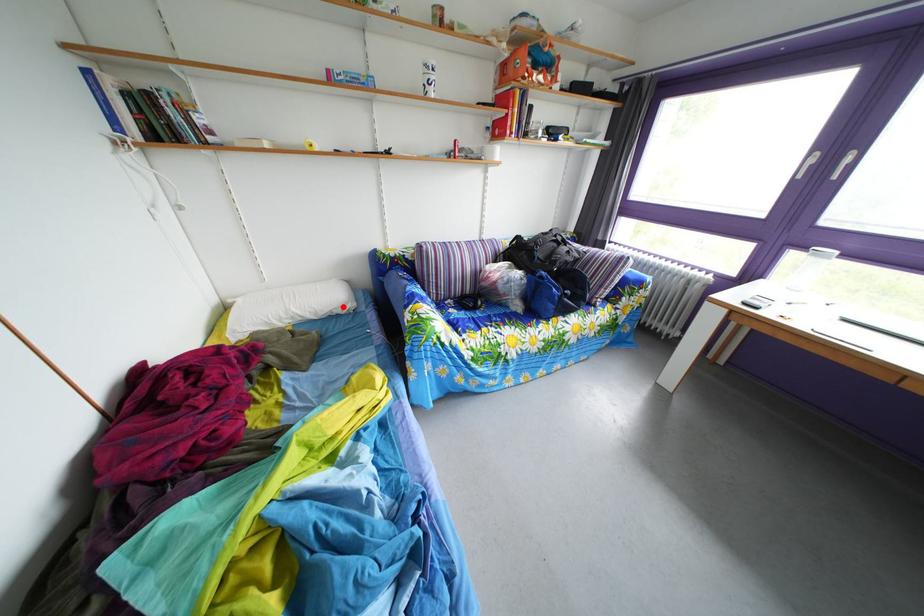
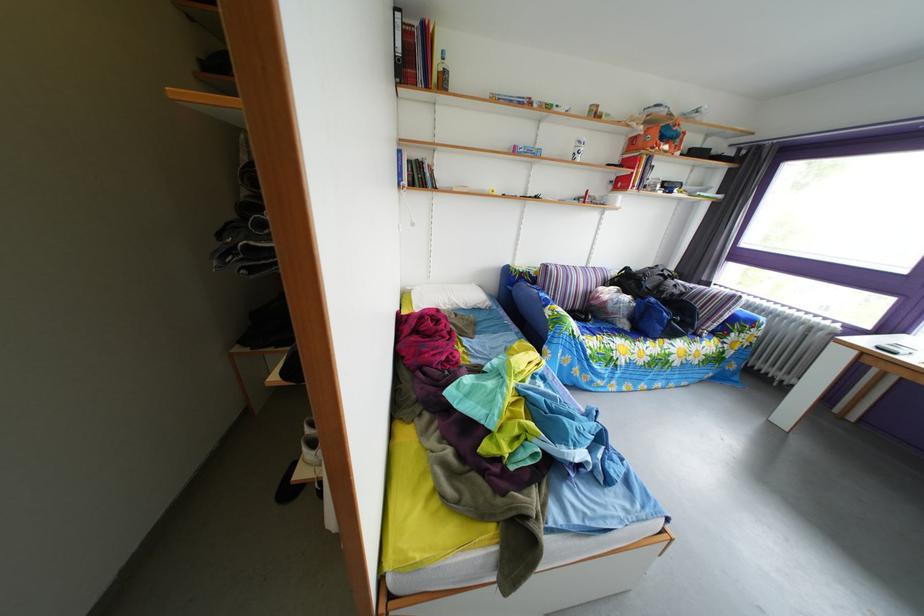
Question: I am providing you with two images of the same scene from different viewpoints. A red point is shown in image1. For the corresponding object point in image2, is it positioned nearer or farther from the camera?

Choices:
 (A) Nearer
 (B) Farther

Answer: (B)